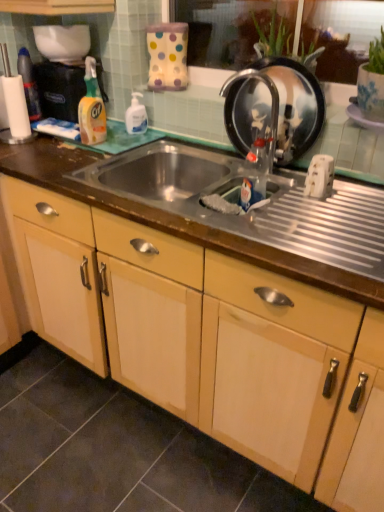
Question: Is polka dot fabric bag at upper center, the 1th appliance positioned from the left, aimed at wooden cabinet at center?

Choices:
 (A) no
 (B) yes

Answer: (A)

Question: Can you confirm if polka dot fabric bag at upper center, marked as the 2th appliance in a right-to-left arrangement, is positioned to the left of wooden cabinet at center?

Choices:
 (A) no
 (B) yes

Answer: (A)

Question: Is polka dot fabric bag at upper center, acting as the 1th appliance starting from the top, wider than wooden cabinet at center?

Choices:
 (A) yes
 (B) no

Answer: (B)

Question: From a real-world perspective, is polka dot fabric bag at upper center, acting as the 1th appliance starting from the top, physically above wooden cabinet at center?

Choices:
 (A) yes
 (B) no

Answer: (A)

Question: Is polka dot fabric bag at upper center, acting as the 1th appliance starting from the top, smaller than wooden cabinet at center?

Choices:
 (A) yes
 (B) no

Answer: (A)

Question: Can you confirm if polka dot fabric bag at upper center, marked as the 2th appliance in a right-to-left arrangement, is taller than wooden cabinet at center?

Choices:
 (A) yes
 (B) no

Answer: (B)

Question: From a real-world perspective, is metallic silver frying pan at upper right, placed as the second appliance when sorted from top to bottom, physically below white glossy pump bottle at upper center, which is the 1th cleaning product from right to left?

Choices:
 (A) no
 (B) yes

Answer: (A)

Question: From the image's perspective, is metallic silver frying pan at upper right, positioned as the 1th appliance in right-to-left order, located beneath white glossy pump bottle at upper center, which is the 1th cleaning product from right to left?

Choices:
 (A) no
 (B) yes

Answer: (B)

Question: Is metallic silver frying pan at upper right, placed as the second appliance when sorted from top to bottom, not inside white glossy pump bottle at upper center, the second cleaning product viewed from the left?

Choices:
 (A) yes
 (B) no

Answer: (A)

Question: Considering the relative sizes of metallic silver frying pan at upper right, positioned as the 1th appliance in right-to-left order, and white glossy pump bottle at upper center, the second cleaning product viewed from the left, in the image provided, is metallic silver frying pan at upper right, positioned as the 1th appliance in right-to-left order, thinner than white glossy pump bottle at upper center, the second cleaning product viewed from the left,?

Choices:
 (A) no
 (B) yes

Answer: (B)

Question: Considering the relative positions of metallic silver frying pan at upper right, placed as the second appliance when sorted from top to bottom, and white glossy pump bottle at upper center, which is the 1th cleaning product from right to left, in the image provided, is metallic silver frying pan at upper right, placed as the second appliance when sorted from top to bottom, to the left of white glossy pump bottle at upper center, which is the 1th cleaning product from right to left, from the viewer's perspective?

Choices:
 (A) yes
 (B) no

Answer: (B)

Question: Could you tell me if metallic silver frying pan at upper right, positioned as the 1th appliance in right-to-left order, is facing white glossy pump bottle at upper center, which is the 1th cleaning product from right to left?

Choices:
 (A) yes
 (B) no

Answer: (B)

Question: Does translucent plastic bottle at center, which is the 2th bottle in top-to-bottom order, have a greater width compared to translucent plastic bottle at upper left, which is the first bottle from top to bottom?

Choices:
 (A) yes
 (B) no

Answer: (A)